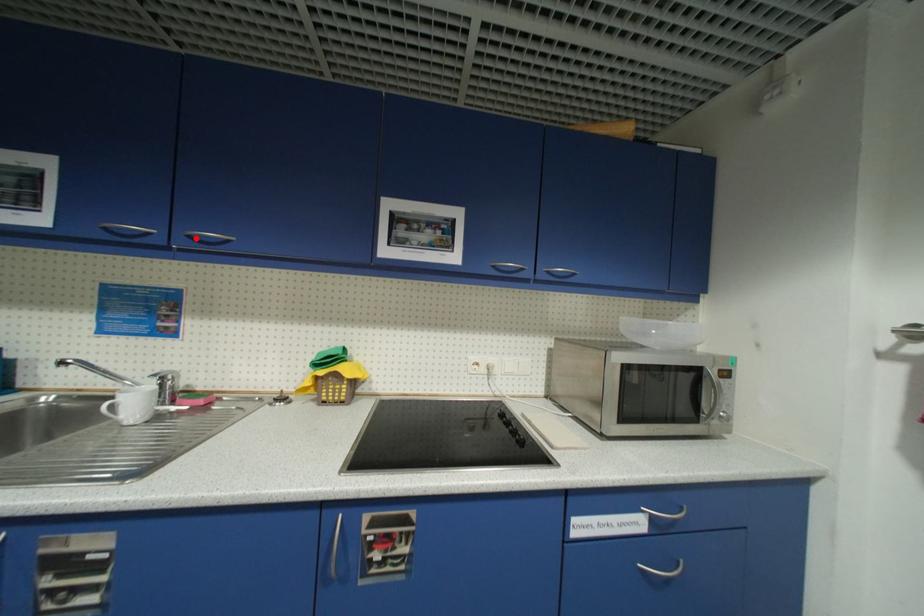
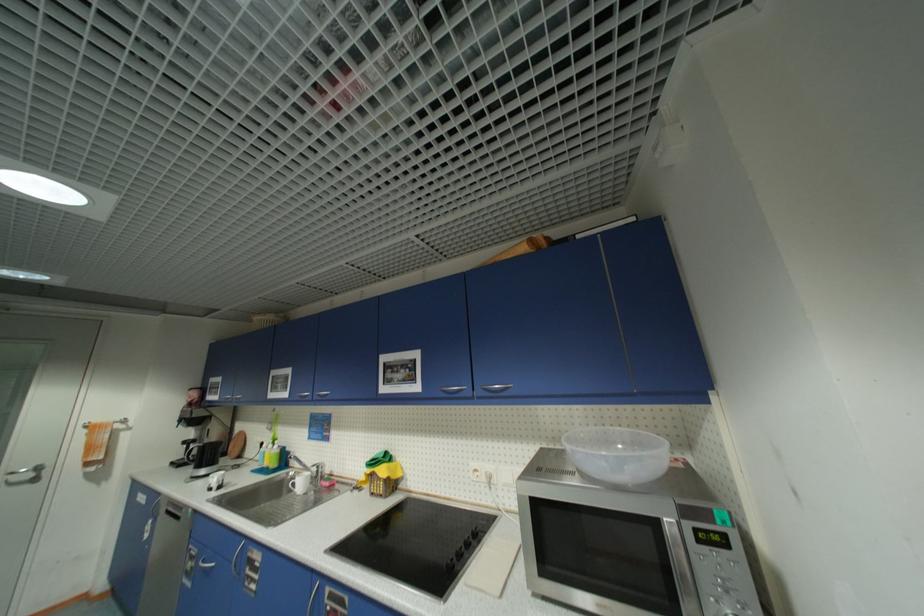
The point at the highlighted location is marked in the first image. Where is the corresponding point in the second image?

(323, 395)